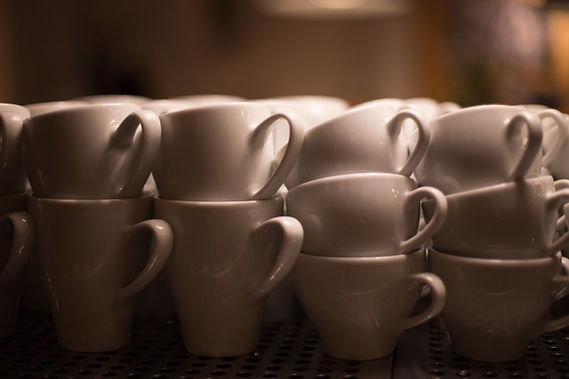
Identify the location of cup handles. (522, 115), (402, 127), (281, 120), (135, 118), (147, 254), (292, 233), (438, 216), (432, 301), (562, 198).